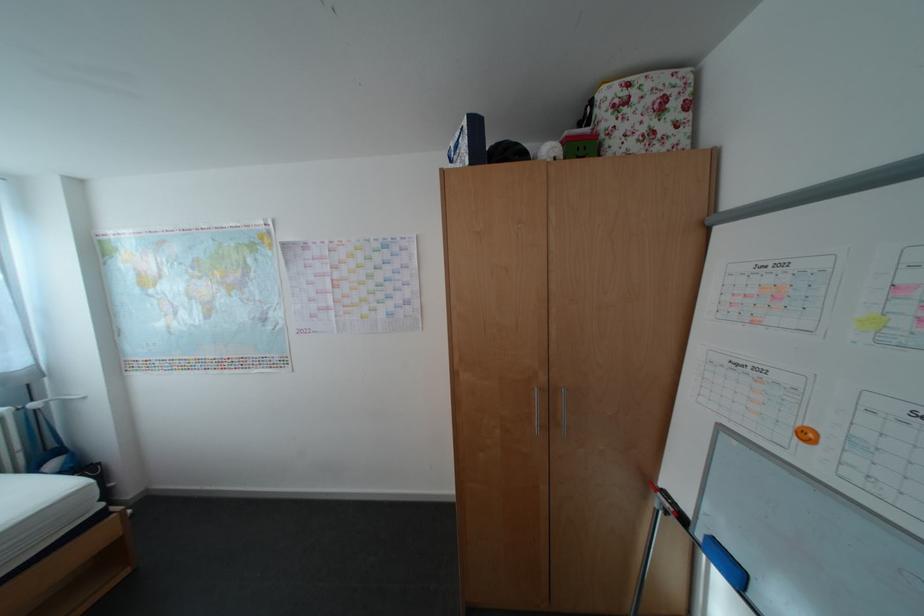
Where would you grip the blue whiteboard eraser? Please return your answer as a coordinate pair (x, y).

(724, 562)